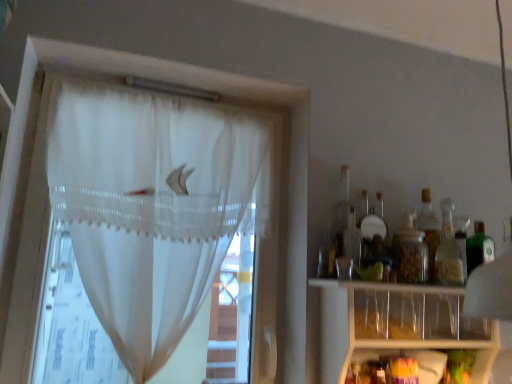
In order to click on white sheer curtain at left in this screenshot , I will do `click(153, 205)`.

Identify the location of translucent glass bottle at right, positioned as the 1th bottle in right-to-left order. (448, 251).

Image resolution: width=512 pixels, height=384 pixels. I want to click on white sheer curtain at left, so click(x=153, y=205).

From the image's perspective, which is below, translucent glass bottle at right, acting as the second bottle starting from the left, or transparent glass jar at right, the second bottle positioned from the right?

transparent glass jar at right, the second bottle positioned from the right, is shown below in the image.

Looking at this image, considering the sizes of objects translucent glass bottle at right, positioned as the 1th bottle in right-to-left order, and transparent glass jar at right, the first bottle in the left-to-right sequence, in the image provided, who is wider, translucent glass bottle at right, positioned as the 1th bottle in right-to-left order, or transparent glass jar at right, the first bottle in the left-to-right sequence,?

translucent glass bottle at right, positioned as the 1th bottle in right-to-left order, is wider.

Considering the points (449, 210) and (395, 249), which point is in front, point (449, 210) or point (395, 249)?

The point (395, 249) is more forward.

From the picture: Between translucent glass bottle at right, positioned as the 1th bottle in right-to-left order, and transparent glass jar at right, the first bottle in the left-to-right sequence, which one has more height?

translucent glass bottle at right, positioned as the 1th bottle in right-to-left order.

From a real-world perspective, which object stands above the other?

transparent glass jar at right, the second bottle positioned from the right.

Who is more distant, transparent glass jar at right, the first bottle in the left-to-right sequence, or white sheer curtain at left?

transparent glass jar at right, the first bottle in the left-to-right sequence, is more distant.

Is transparent glass jar at right, the first bottle in the left-to-right sequence, oriented towards white sheer curtain at left?

No, transparent glass jar at right, the first bottle in the left-to-right sequence, is not turned towards white sheer curtain at left.

Considering the positions of objects translucent glass bottle at right, positioned as the 1th bottle in right-to-left order, and clear plastic shelf at lower right in the image provided, who is behind, translucent glass bottle at right, positioned as the 1th bottle in right-to-left order, or clear plastic shelf at lower right?

translucent glass bottle at right, positioned as the 1th bottle in right-to-left order, is more distant.

Can you tell me how much translucent glass bottle at right, acting as the second bottle starting from the left, and clear plastic shelf at lower right differ in facing direction?

They differ by 1.21 degrees in their facing directions.

Is point (437, 259) positioned before point (371, 347)?

No, it is not.

From a real-world perspective, who is located higher, translucent glass bottle at right, positioned as the 1th bottle in right-to-left order, or clear plastic shelf at lower right?

translucent glass bottle at right, positioned as the 1th bottle in right-to-left order.

Can you confirm if clear plastic shelf at lower right is positioned to the left of translucent glass bottle at right, acting as the second bottle starting from the left?

Correct, you'll find clear plastic shelf at lower right to the left of translucent glass bottle at right, acting as the second bottle starting from the left.

Does point (360, 315) appear closer or farther from the camera than point (459, 265)?

Point (360, 315) appears to be closer to the viewer than point (459, 265).

From the image's perspective, is clear plastic shelf at lower right positioned above or below translucent glass bottle at right, positioned as the 1th bottle in right-to-left order?

From the image's perspective, clear plastic shelf at lower right appears below translucent glass bottle at right, positioned as the 1th bottle in right-to-left order.

What's the angular difference between clear plastic shelf at lower right and translucent glass bottle at right, positioned as the 1th bottle in right-to-left order,'s facing directions?

The angle between the facing direction of clear plastic shelf at lower right and the facing direction of translucent glass bottle at right, positioned as the 1th bottle in right-to-left order, is 1.21 degrees.

Does translucent glass bottle at right, acting as the second bottle starting from the left, have a greater width compared to white sheer curtain at left?

No, translucent glass bottle at right, acting as the second bottle starting from the left, is not wider than white sheer curtain at left.

Which object is closer to the camera, translucent glass bottle at right, acting as the second bottle starting from the left, or white sheer curtain at left?

white sheer curtain at left is closer to the camera.

Find the location of a particular element. The image size is (512, 384). curtain on the left side of translucent glass bottle at right, positioned as the 1th bottle in right-to-left order is located at coordinates (153, 205).

Is translucent glass bottle at right, acting as the second bottle starting from the left, facing towards white sheer curtain at left?

No, translucent glass bottle at right, acting as the second bottle starting from the left, is not facing towards white sheer curtain at left.

Could you tell me if transparent glass jar at right, the second bottle positioned from the right, is turned towards translucent glass bottle at right, acting as the second bottle starting from the left?

No, transparent glass jar at right, the second bottle positioned from the right, does not turn towards translucent glass bottle at right, acting as the second bottle starting from the left.

Considering the relative sizes of transparent glass jar at right, the first bottle in the left-to-right sequence, and translucent glass bottle at right, positioned as the 1th bottle in right-to-left order, in the image provided, is transparent glass jar at right, the first bottle in the left-to-right sequence, bigger than translucent glass bottle at right, positioned as the 1th bottle in right-to-left order,?

Correct, transparent glass jar at right, the first bottle in the left-to-right sequence, is larger in size than translucent glass bottle at right, positioned as the 1th bottle in right-to-left order.

From a real-world perspective, is transparent glass jar at right, the second bottle positioned from the right, above or below translucent glass bottle at right, acting as the second bottle starting from the left?

In terms of real-world spatial position, transparent glass jar at right, the second bottle positioned from the right, is below translucent glass bottle at right, acting as the second bottle starting from the left.

Is white sheer curtain at left situated inside transparent glass jar at right, the second bottle positioned from the right, or outside?

white sheer curtain at left exists outside the volume of transparent glass jar at right, the second bottle positioned from the right.

Are white sheer curtain at left and transparent glass jar at right, the first bottle in the left-to-right sequence, located far from each other?

white sheer curtain at left is near transparent glass jar at right, the first bottle in the left-to-right sequence, not far away.

Who is taller, white sheer curtain at left or transparent glass jar at right, the second bottle positioned from the right?

Standing taller between the two is white sheer curtain at left.

Can you confirm if white sheer curtain at left is bigger than transparent glass jar at right, the first bottle in the left-to-right sequence?

Yes.

Identify the location of bottle that appears in front of the translucent glass bottle at right, positioned as the 1th bottle in right-to-left order. point(410,253).

What are the coordinates of `curtain on the left of the transparent glass jar at right, the first bottle in the left-to-right sequence` in the screenshot? It's located at (153, 205).

Looking at the image, which one is located closer to translucent glass bottle at right, positioned as the 1th bottle in right-to-left order, transparent glass jar at right, the second bottle positioned from the right, or white sheer curtain at left?

transparent glass jar at right, the second bottle positioned from the right, is closer to translucent glass bottle at right, positioned as the 1th bottle in right-to-left order.

When comparing their distances from transparent glass jar at right, the second bottle positioned from the right, does translucent glass bottle at right, positioned as the 1th bottle in right-to-left order, or clear plastic shelf at lower right seem closer?

Based on the image, translucent glass bottle at right, positioned as the 1th bottle in right-to-left order, appears to be nearer to transparent glass jar at right, the second bottle positioned from the right.

Looking at the image, which one is located further to white sheer curtain at left, clear plastic shelf at lower right or translucent glass bottle at right, acting as the second bottle starting from the left?

Among the two, translucent glass bottle at right, acting as the second bottle starting from the left, is located further to white sheer curtain at left.

Based on their spatial positions, is transparent glass jar at right, the second bottle positioned from the right, or translucent glass bottle at right, positioned as the 1th bottle in right-to-left order, closer to white sheer curtain at left?

transparent glass jar at right, the second bottle positioned from the right, is positioned closer to the anchor white sheer curtain at left.

Estimate the real-world distances between objects in this image. Which object is further from white sheer curtain at left, translucent glass bottle at right, acting as the second bottle starting from the left, or transparent glass jar at right, the first bottle in the left-to-right sequence?

translucent glass bottle at right, acting as the second bottle starting from the left, lies further to white sheer curtain at left than the other object.

Considering their positions, is clear plastic shelf at lower right positioned further to transparent glass jar at right, the first bottle in the left-to-right sequence, than translucent glass bottle at right, acting as the second bottle starting from the left?

clear plastic shelf at lower right is positioned further to the anchor transparent glass jar at right, the first bottle in the left-to-right sequence.

Which object lies further to the anchor point clear plastic shelf at lower right, white sheer curtain at left or transparent glass jar at right, the first bottle in the left-to-right sequence?

Among the two, white sheer curtain at left is located further to clear plastic shelf at lower right.

When comparing their distances from translucent glass bottle at right, acting as the second bottle starting from the left, does white sheer curtain at left or transparent glass jar at right, the second bottle positioned from the right, seem closer?

The object closer to translucent glass bottle at right, acting as the second bottle starting from the left, is transparent glass jar at right, the second bottle positioned from the right.

Find the location of a particular element. The width and height of the screenshot is (512, 384). shelf situated between white sheer curtain at left and translucent glass bottle at right, positioned as the 1th bottle in right-to-left order, from left to right is located at coordinates (395, 324).

You are a GUI agent. You are given a task and a screenshot of the screen. Output one action in this format:
    pyautogui.click(x=<x>, y=<y>)
    Task: Click on the bottle between translucent glass bottle at right, positioned as the 1th bottle in right-to-left order, and clear plastic shelf at lower right from top to bottom
    The height and width of the screenshot is (384, 512).
    Given the screenshot: What is the action you would take?
    pyautogui.click(x=410, y=253)

Identify the location of bottle situated between white sheer curtain at left and clear plastic shelf at lower right from left to right. click(x=410, y=253).

Identify the location of bottle between white sheer curtain at left and translucent glass bottle at right, positioned as the 1th bottle in right-to-left order. The height and width of the screenshot is (384, 512). (410, 253).